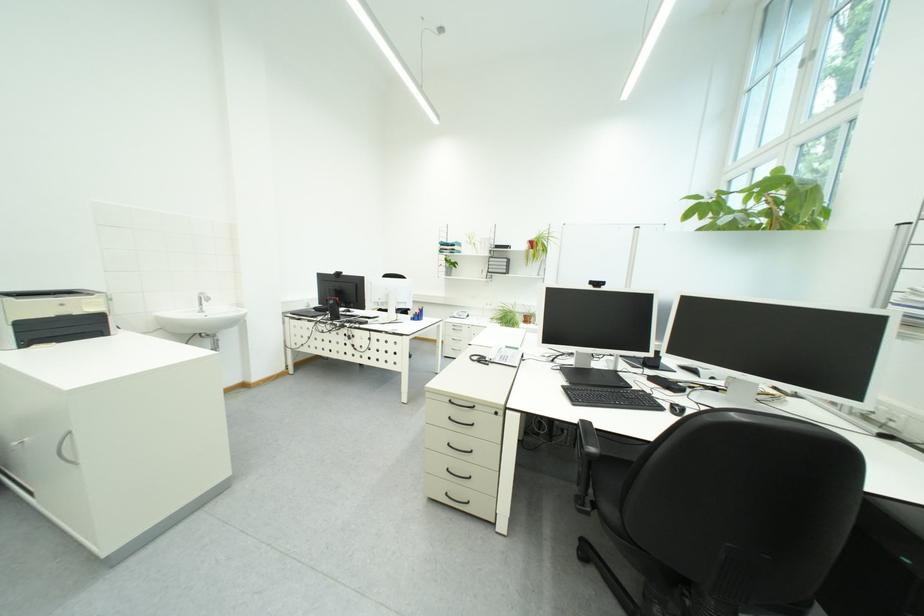
Describe the element at coordinates (458, 448) in the screenshot. I see `a drawer handle` at that location.